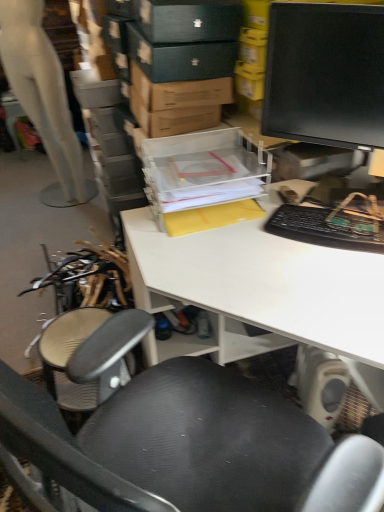
This screenshot has width=384, height=512. In order to click on vacant space in front of transparent plastic storage box at center in this screenshot , I will do `click(223, 257)`.